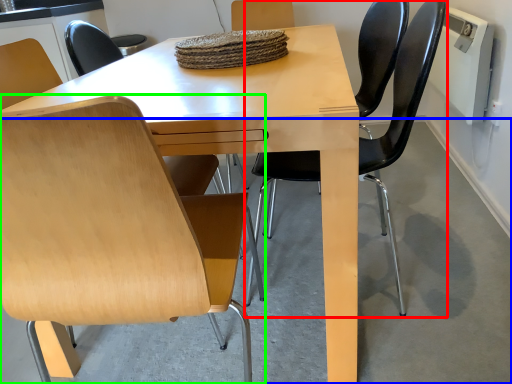
Question: Which object is the farthest from chair (highlighted by a red box)? Choose among these: concrete (highlighted by a blue box) or chair (highlighted by a green box).

Choices:
 (A) concrete
 (B) chair

Answer: (B)